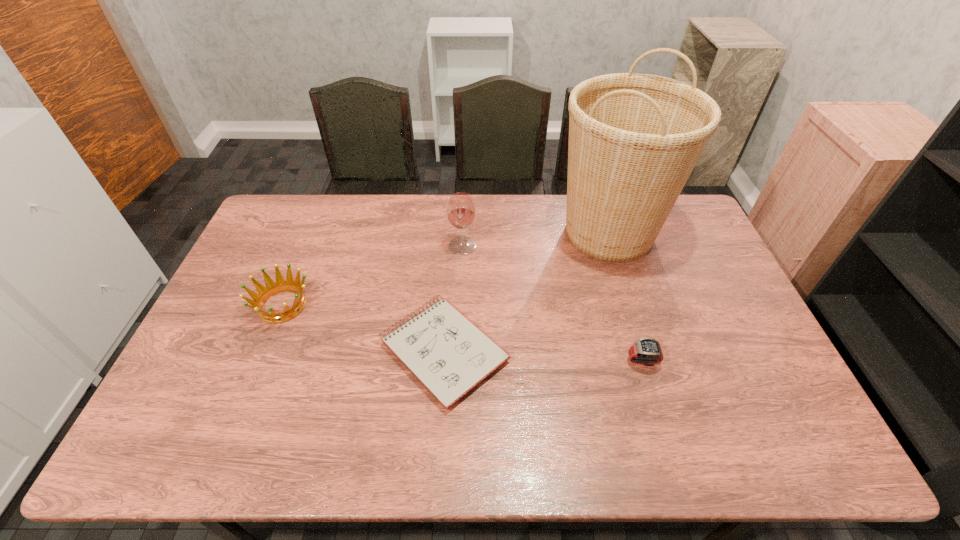
Where is `free space located 0.050m on the left of the shortest object`? The image size is (960, 540). free space located 0.050m on the left of the shortest object is located at coordinates (360, 351).

This screenshot has height=540, width=960. I want to click on object situated at the far edge, so click(x=634, y=139).

I want to click on object at the left edge, so pos(264,293).

Find the location of `object situated at the right edge`. object situated at the right edge is located at coordinates (634, 139).

At what (x,y) coordinates should I click in order to perform the action: click on object present at the far right corner. Please return your answer as a coordinate pair (x, y). The image size is (960, 540). Looking at the image, I should click on (634, 139).

The width and height of the screenshot is (960, 540). I want to click on vacant space at the far edge of the desktop, so click(x=517, y=199).

Locate an element on the screen. This screenshot has width=960, height=540. vacant region at the near edge of the desktop is located at coordinates (468, 437).

Locate an element on the screen. vacant space at the left edge is located at coordinates click(x=231, y=284).

This screenshot has width=960, height=540. What are the coordinates of `vacant space at the right edge of the desktop` in the screenshot? It's located at (765, 366).

Find the location of a particular element. vacant space at the far right corner is located at coordinates (694, 226).